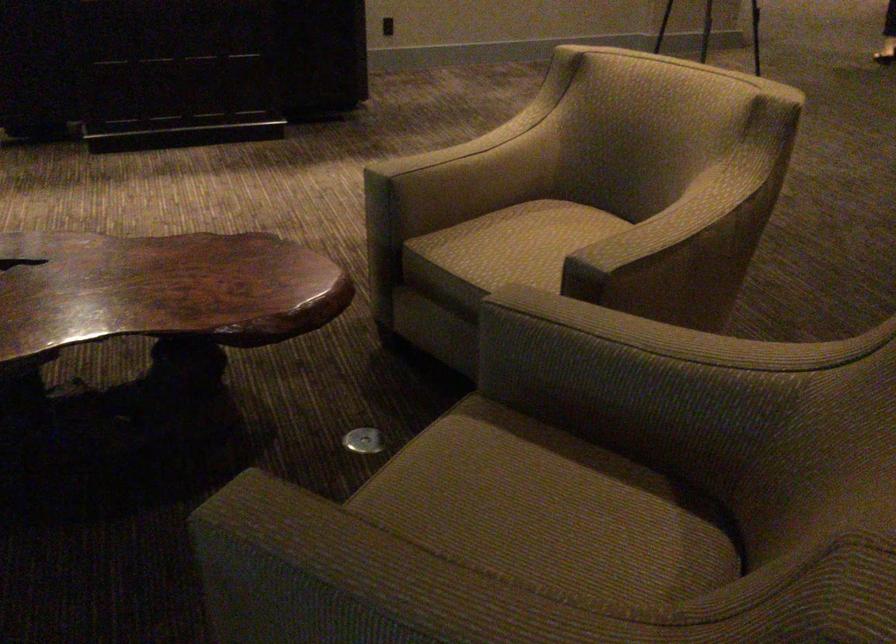
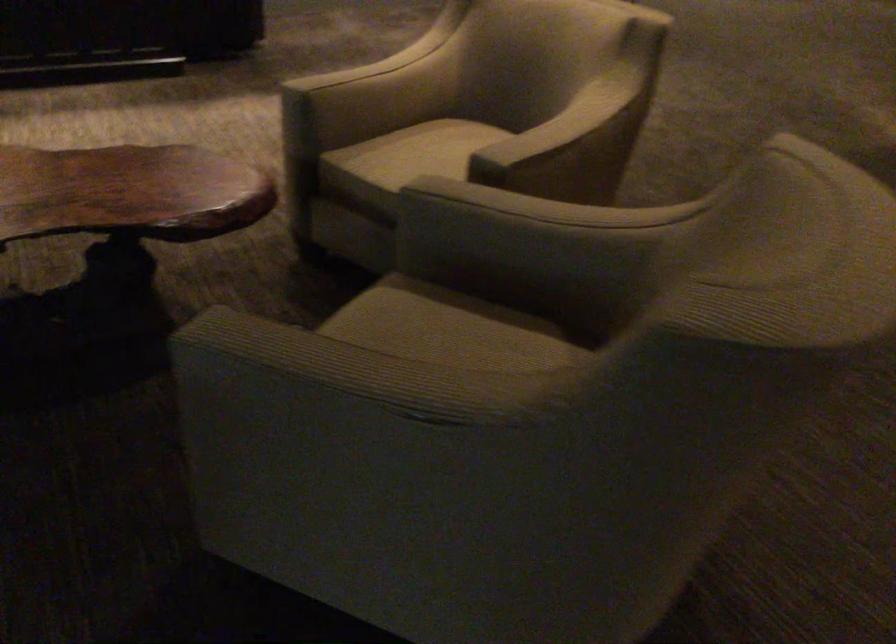
Question: The camera is either moving clockwise (left) or counter-clockwise (right) around the object. The first image is from the beginning of the video and the second image is from the end. Is the camera moving left or right when shooting the video?

Choices:
 (A) Left
 (B) Right

Answer: (A)